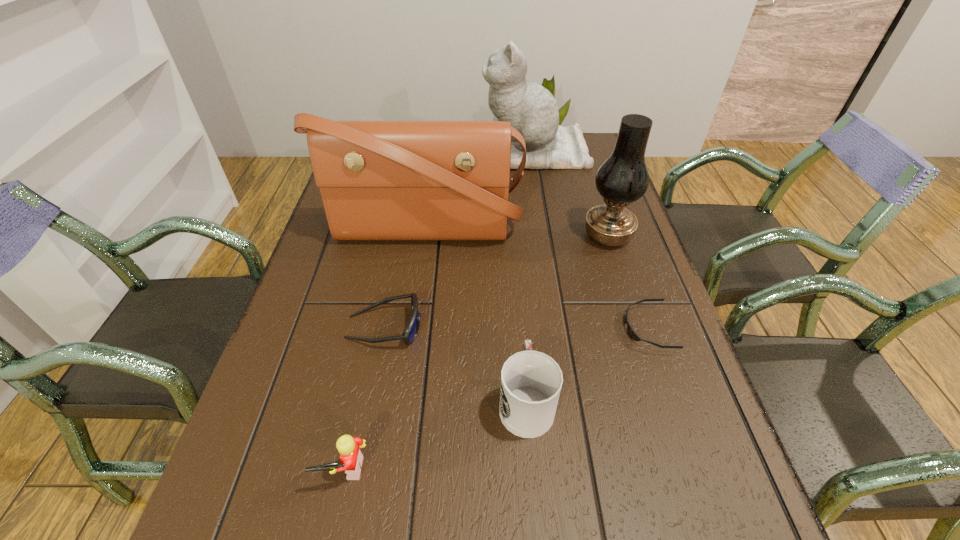
Image resolution: width=960 pixels, height=540 pixels. What are the coordinates of `free space at the left edge of the desktop` in the screenshot? It's located at (283, 512).

Find the location of a particular element. blank space at the right edge is located at coordinates (615, 392).

The image size is (960, 540). I want to click on vacant area that lies between the cat and the cup, so click(x=530, y=276).

Locate an element on the screen. free space between the cat and the shortest object is located at coordinates (591, 240).

Identify the location of empty space between the sixth farthest object and the left sunglasses. The height and width of the screenshot is (540, 960). (455, 364).

Where is `unoccupied position between the second nearest object and the oil lamp`? This screenshot has height=540, width=960. unoccupied position between the second nearest object and the oil lamp is located at coordinates (566, 318).

In order to click on unoccupied area between the oil lamp and the cat in this screenshot , I will do `click(571, 194)`.

Locate an element on the screen. This screenshot has height=540, width=960. free space between the Lego and the taller sunglasses is located at coordinates [x=365, y=399].

This screenshot has width=960, height=540. Identify the location of free spot between the shorter sunglasses and the satchel. (537, 279).

Identify the location of free point between the shortest object and the fifth tallest object. The image size is (960, 540). (496, 399).